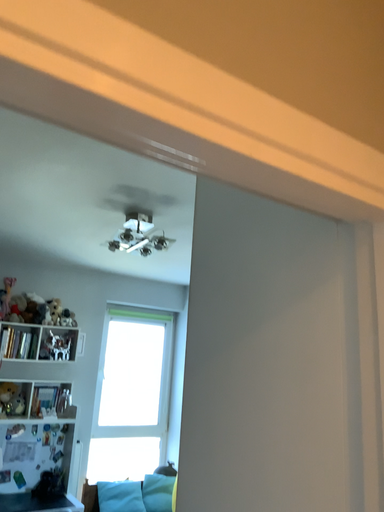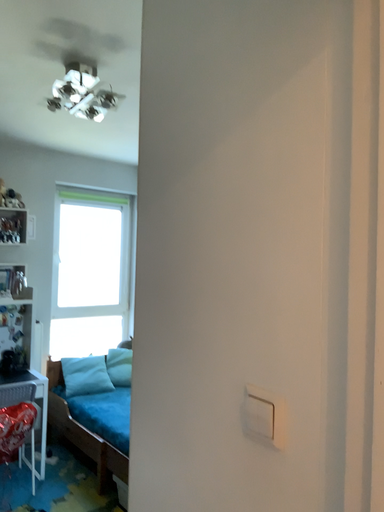
Question: Which way did the camera rotate in the video?

Choices:
 (A) rotated upward
 (B) rotated downward

Answer: (B)